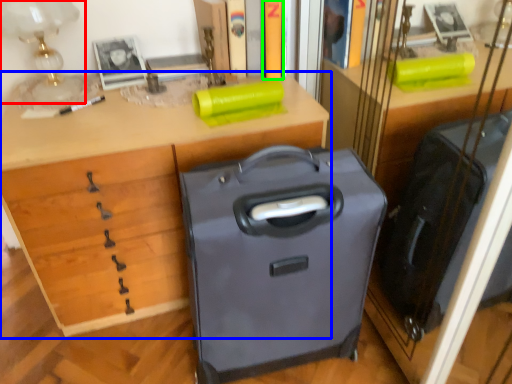
Question: Which object is positioned farthest from table lamp (highlighted by a red box)? Select from desk (highlighted by a blue box) and book (highlighted by a green box).

Choices:
 (A) desk
 (B) book

Answer: (B)